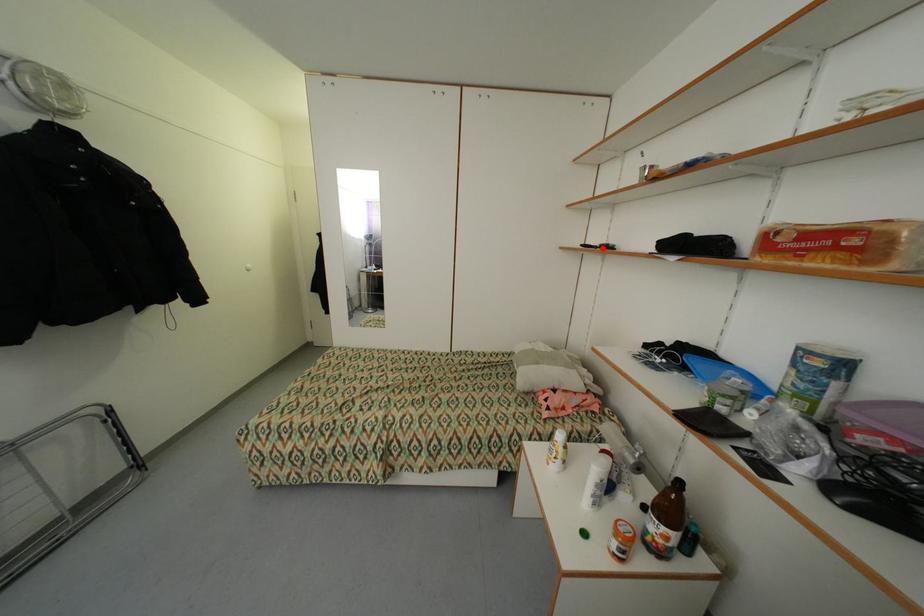
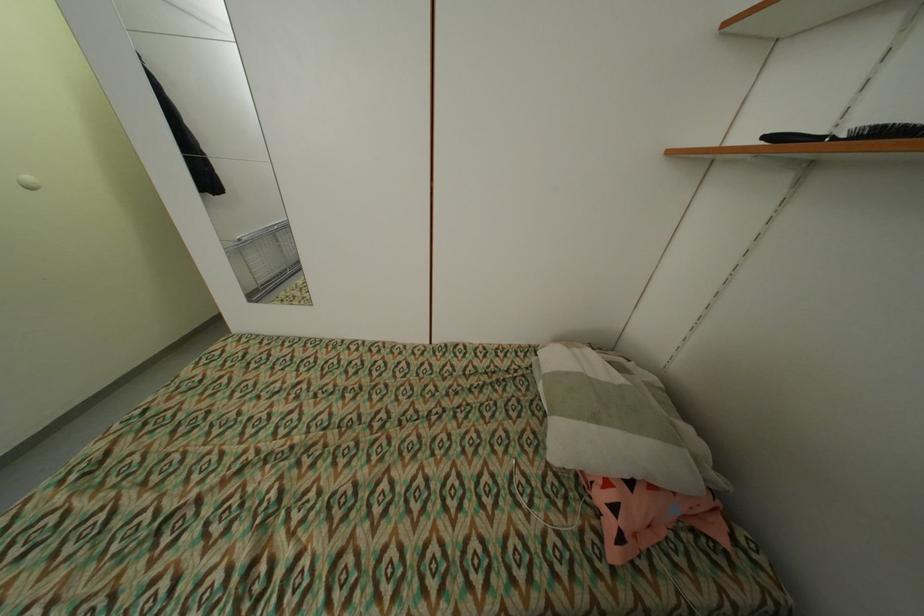
Where in the second image is the point corresponding to the highlighted location from the first image?

(841, 140)